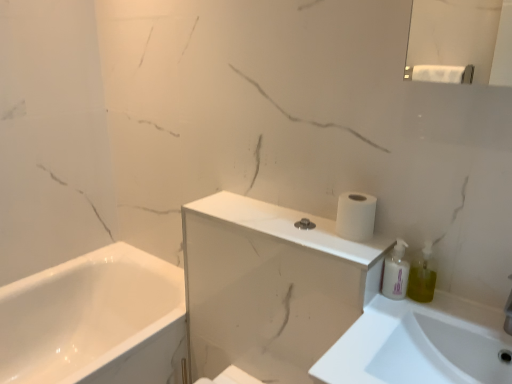
Question: Is white glossy medicine cabinet at upper center further to the viewer compared to green translucent soap dispenser at right?

Choices:
 (A) yes
 (B) no

Answer: (B)

Question: Can you confirm if white glossy medicine cabinet at upper center is bigger than green translucent soap dispenser at right?

Choices:
 (A) yes
 (B) no

Answer: (A)

Question: From the image's perspective, would you say white glossy medicine cabinet at upper center is positioned over green translucent soap dispenser at right?

Choices:
 (A) no
 (B) yes

Answer: (A)

Question: Does white glossy medicine cabinet at upper center have a lesser width compared to green translucent soap dispenser at right?

Choices:
 (A) yes
 (B) no

Answer: (B)

Question: Is white glossy medicine cabinet at upper center positioned with its back to green translucent soap dispenser at right?

Choices:
 (A) yes
 (B) no

Answer: (B)

Question: From their relative heights in the image, would you say white matte toilet paper at upper right is taller or shorter than white glossy pump bottle at right?

Choices:
 (A) tall
 (B) short

Answer: (B)

Question: Do you think white matte toilet paper at upper right is within white glossy pump bottle at right, or outside of it?

Choices:
 (A) inside
 (B) outside

Answer: (B)

Question: Is point (362, 221) closer or farther from the camera than point (401, 268)?

Choices:
 (A) closer
 (B) farther

Answer: (A)

Question: Considering the positions of white matte toilet paper at upper right and white glossy pump bottle at right in the image, is white matte toilet paper at upper right bigger or smaller than white glossy pump bottle at right?

Choices:
 (A) big
 (B) small

Answer: (A)

Question: Considering the positions of white matte toilet paper at upper right and green translucent soap dispenser at right in the image, is white matte toilet paper at upper right wider or thinner than green translucent soap dispenser at right?

Choices:
 (A) wide
 (B) thin

Answer: (A)

Question: From a real-world perspective, is white matte toilet paper at upper right above or below green translucent soap dispenser at right?

Choices:
 (A) below
 (B) above

Answer: (B)

Question: Is white matte toilet paper at upper right bigger or smaller than green translucent soap dispenser at right?

Choices:
 (A) big
 (B) small

Answer: (A)

Question: Does point click(x=368, y=226) appear closer or farther from the camera than point click(x=415, y=299)?

Choices:
 (A) farther
 (B) closer

Answer: (A)

Question: Is white glossy medicine cabinet at upper center bigger or smaller than green translucent soap dispenser at right?

Choices:
 (A) big
 (B) small

Answer: (A)

Question: From a real-world perspective, is white glossy medicine cabinet at upper center positioned above or below green translucent soap dispenser at right?

Choices:
 (A) above
 (B) below

Answer: (B)